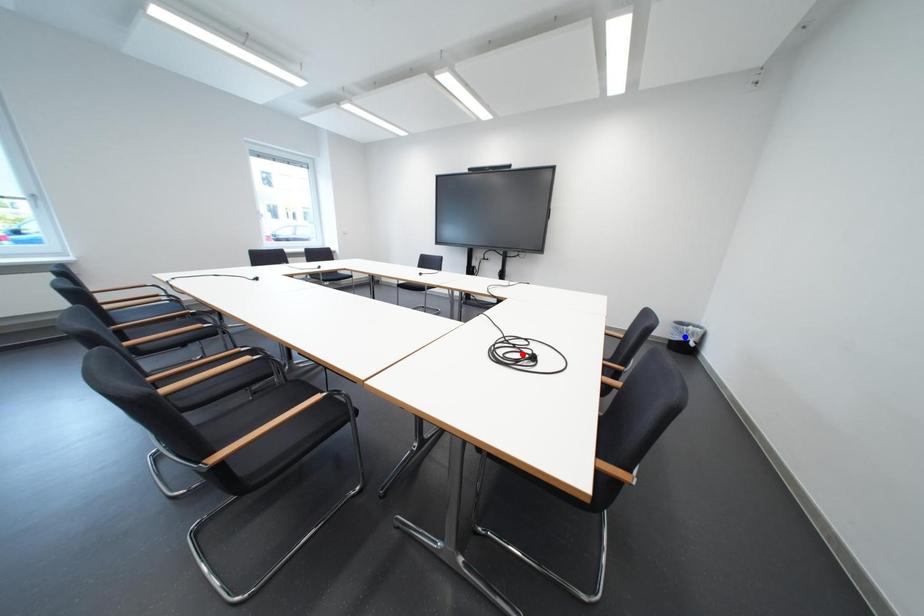
Question: In the image, two points are highlighted. Which point is nearer to the camera? Reply with the corresponding letter.

Choices:
 (A) blue point
 (B) red point

Answer: (B)